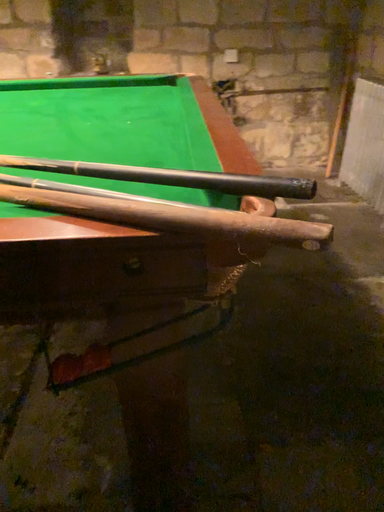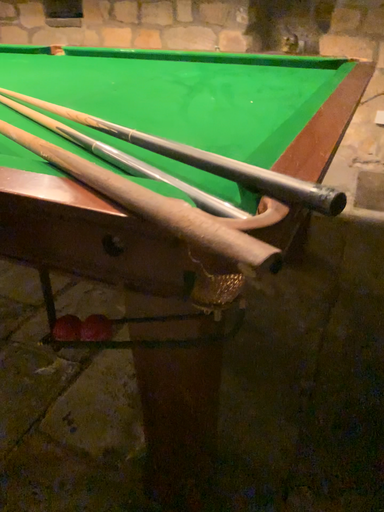
Question: How did the camera likely rotate when shooting the video?

Choices:
 (A) rotated left
 (B) rotated right

Answer: (A)